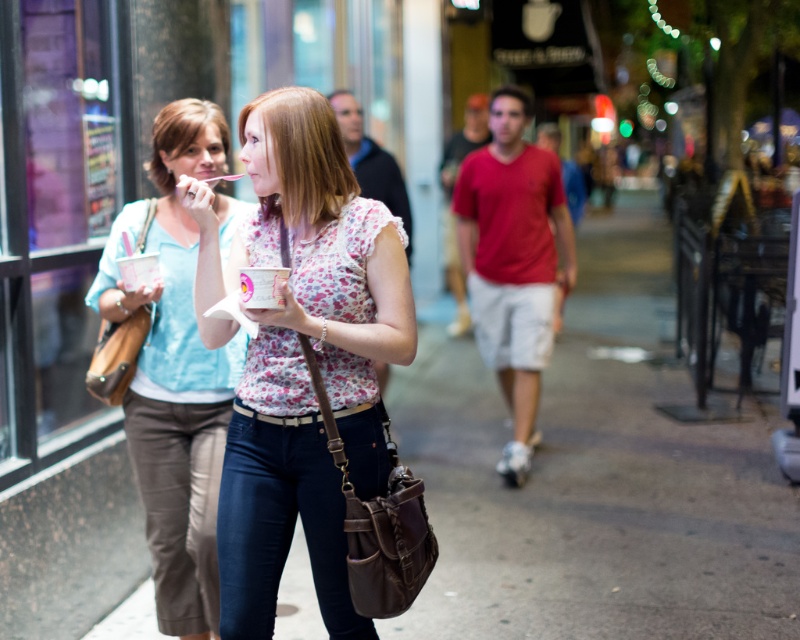
Is point (778, 476) positioned before point (233, 371)?

No, (778, 476) is behind (233, 371).

Is matte brown bag at center below matte pink ice cream cup at center?

Actually, matte brown bag at center is above matte pink ice cream cup at center.

Which is behind, point (776, 365) or point (208, 442)?

The point (776, 365) is behind.

Locate an element on the screen. matte brown bag at center is located at coordinates (598, 476).

You are a GUI agent. You are given a task and a screenshot of the screen. Output one action in this format:
    pyautogui.click(x=<x>, y=<y>)
    Task: Click on the matte brown bag at center
    
    Given the screenshot: What is the action you would take?
    pyautogui.click(x=598, y=476)

Does matte brown bag at center appear on the right side of floral fabric shirt at center?

Correct, you'll find matte brown bag at center to the right of floral fabric shirt at center.

Is point (729, 372) positioned in front of point (300, 236)?

That is False.

Where is `matte brown bag at center`? This screenshot has height=640, width=800. matte brown bag at center is located at coordinates (598, 476).

Is matte pink ice cream cup at center smaller than dark blue denim jeans at center?

No, matte pink ice cream cup at center is not smaller than dark blue denim jeans at center.

Which of these two, matte pink ice cream cup at center or dark blue denim jeans at center, stands shorter?

dark blue denim jeans at center is shorter.

The width and height of the screenshot is (800, 640). What do you see at coordinates (178, 380) in the screenshot? I see `matte pink ice cream cup at center` at bounding box center [178, 380].

Locate an element on the screen. The width and height of the screenshot is (800, 640). matte pink ice cream cup at center is located at coordinates (178, 380).